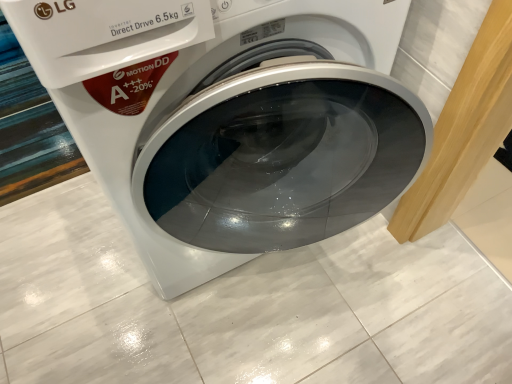
In order to click on white glossy washing machine at center in this screenshot , I will do click(230, 119).

Describe the element at coordinates (230, 119) in the screenshot. I see `white glossy washing machine at center` at that location.

The image size is (512, 384). What are the coordinates of `white glossy washing machine at center` in the screenshot? It's located at (230, 119).